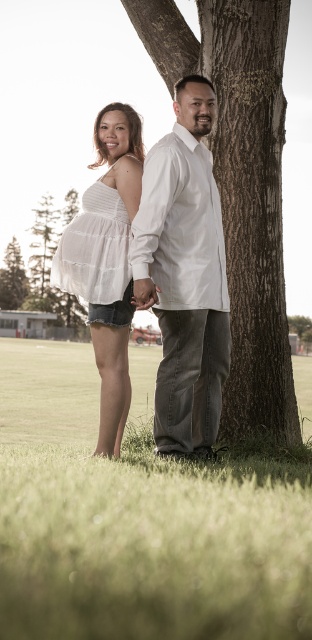
The width and height of the screenshot is (312, 640). What do you see at coordinates (250, 209) in the screenshot?
I see `brown rough tree trunk at center` at bounding box center [250, 209].

Which is behind, point (268, 282) or point (154, 308)?

The point (268, 282) is more distant.

Who is more forward, (263, 417) or (214, 275)?

Point (214, 275) is in front.

You are a GUI agent. You are given a task and a screenshot of the screen. Output one action in this format:
    pyautogui.click(x=<x>, y=<y>)
    Task: Click on the brown rough tree trunk at center
    
    Given the screenshot: What is the action you would take?
    pyautogui.click(x=250, y=209)

Does point (117, 240) come behind point (136, 292)?

Yes, point (117, 240) is farther from viewer.

Is white sheer dress at center wider than matte white hand at center?

Correct, the width of white sheer dress at center exceeds that of matte white hand at center.

Identify the location of white sheer dress at center. This screenshot has height=640, width=312. (107, 260).

Can you confirm if white cotton dress at left is bigger than green leafy tree at left?

Incorrect, white cotton dress at left is not larger than green leafy tree at left.

Which is above, white cotton dress at left or green leafy tree at left?

green leafy tree at left

This screenshot has height=640, width=312. Describe the element at coordinates (94, 248) in the screenshot. I see `white cotton dress at left` at that location.

Where is `white cotton dress at left`? This screenshot has width=312, height=640. white cotton dress at left is located at coordinates (94, 248).